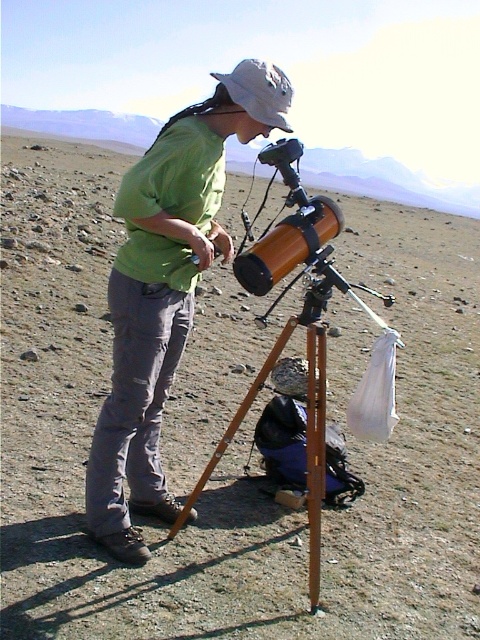
Question: Does green matte shirt at center appear on the right side of white fabric baseball hat at upper center?

Choices:
 (A) no
 (B) yes

Answer: (A)

Question: Is the position of green matte shirt at center more distant than that of wooden tripod at center?

Choices:
 (A) no
 (B) yes

Answer: (B)

Question: Among these objects, which one is nearest to the camera?

Choices:
 (A) white fabric baseball hat at upper center
 (B) wooden tripod at center
 (C) green matte shirt at center

Answer: (B)

Question: Which point is farther to the camera?

Choices:
 (A) (351, 285)
 (B) (127, 417)
 (C) (242, 108)

Answer: (A)

Question: Can you confirm if green matte shirt at center is wider than wooden tripod at center?

Choices:
 (A) yes
 (B) no

Answer: (A)

Question: Among these points, which one is farthest from the camera?

Choices:
 (A) (140, 384)
 (B) (226, 74)
 (C) (309, 413)

Answer: (B)